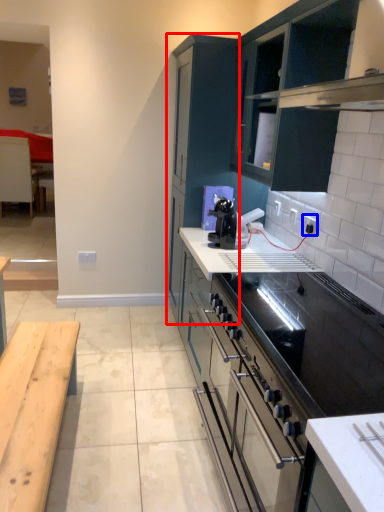
Question: Which point is closer to the camera, cabinetry (highlighted by a red box) or electric outlet (highlighted by a blue box)?

Choices:
 (A) cabinetry
 (B) electric outlet

Answer: (B)